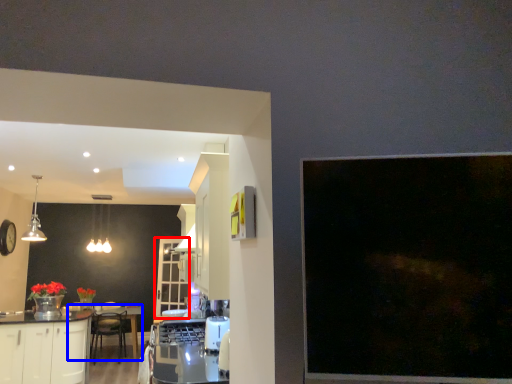
Question: Which point is further to the camera, glass door (highlighted by a red box) or round table (highlighted by a blue box)?

Choices:
 (A) glass door
 (B) round table

Answer: (A)